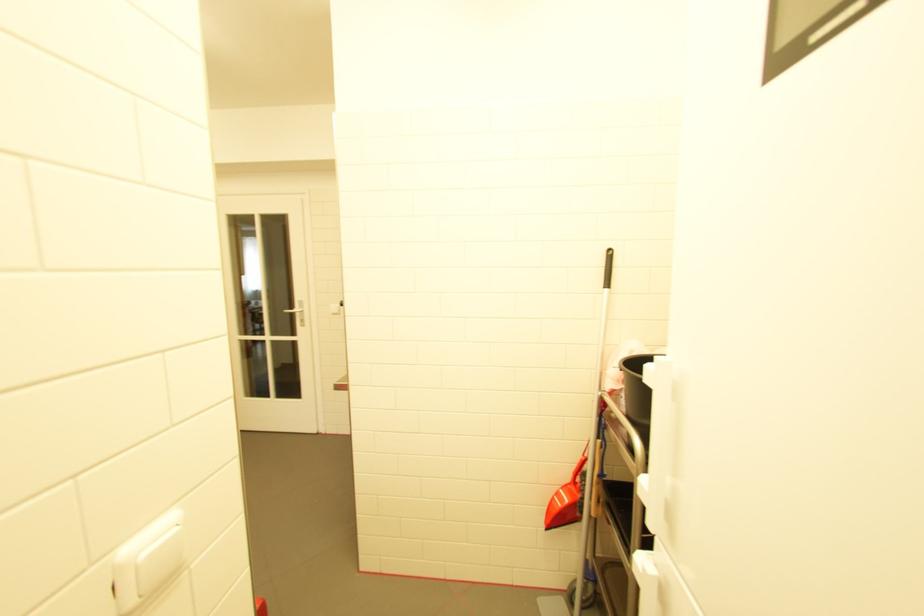
The image size is (924, 616). Find the location of `black broom handle`. black broom handle is located at coordinates (608, 269).